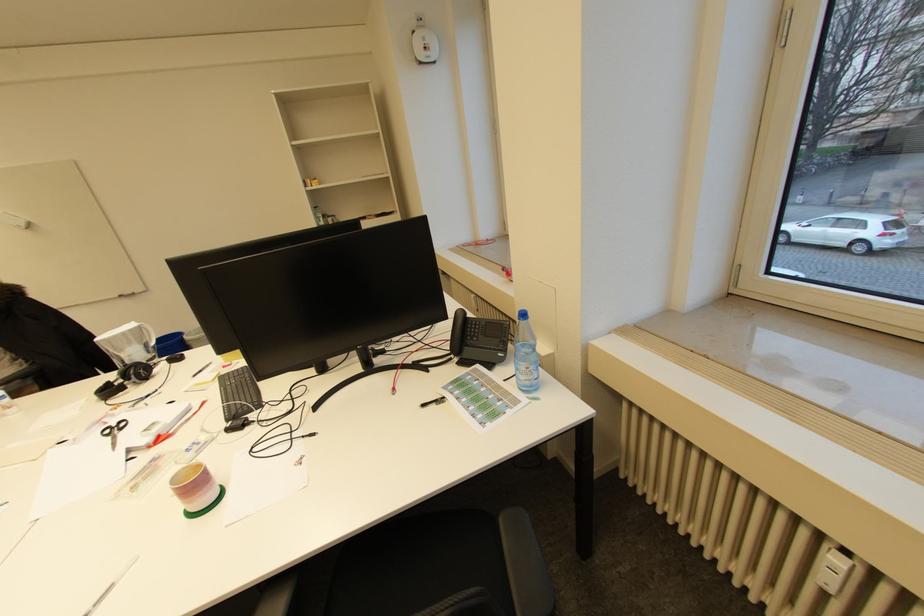
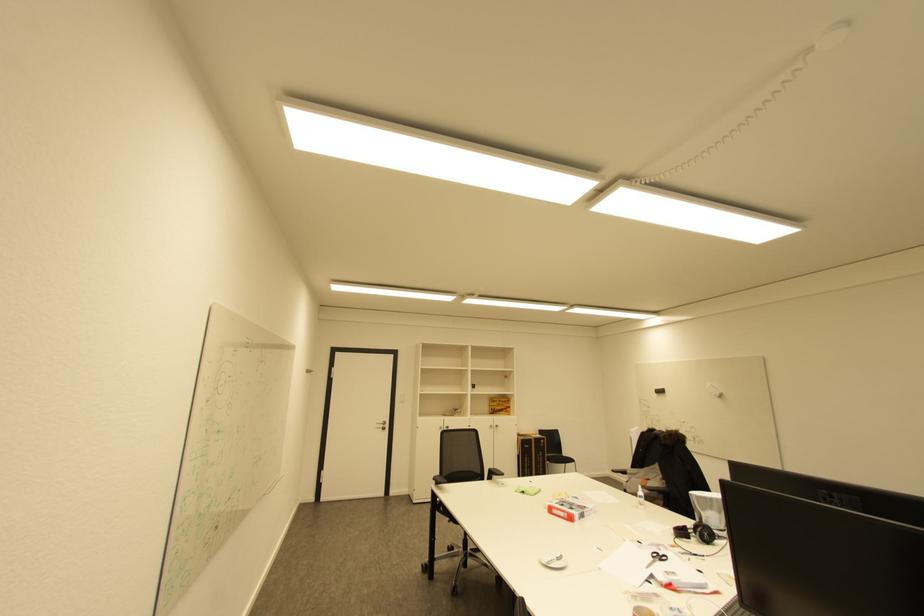
The point at (x=114, y=436) is marked in the first image. Where is the corresponding point in the second image?

(659, 557)